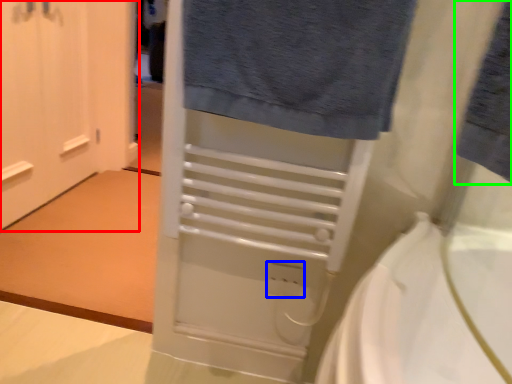
Question: Estimate the real-world distances between objects in this image. Which object is closer to door (highlighted by a red box), electric outlet (highlighted by a blue box) or bath towel (highlighted by a green box)?

Choices:
 (A) electric outlet
 (B) bath towel

Answer: (A)